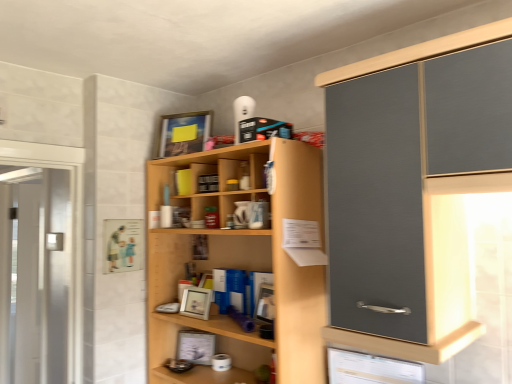
Question: Which direction should I rotate to look at white matte picture frame at center, which ranks as the 2th picture frame in top-to-bottom order?

Choices:
 (A) right
 (B) left

Answer: (B)

Question: From a real-world perspective, does metallic silver picture frame at lower center, which appears as the first picture frame when ordered from the bottom, stand above light wood cupboard at center?

Choices:
 (A) no
 (B) yes

Answer: (A)

Question: Does metallic silver picture frame at lower center, the third picture frame positioned from the top, have a greater width compared to light wood cupboard at center?

Choices:
 (A) yes
 (B) no

Answer: (B)

Question: From the image's perspective, does metallic silver picture frame at lower center, which appears as the first picture frame when ordered from the bottom, appear lower than light wood cupboard at center?

Choices:
 (A) no
 (B) yes

Answer: (B)

Question: Does metallic silver picture frame at lower center, which appears as the first picture frame when ordered from the bottom, turn towards light wood cupboard at center?

Choices:
 (A) yes
 (B) no

Answer: (A)

Question: Is metallic silver picture frame at lower center, the third picture frame positioned from the top, looking in the opposite direction of light wood cupboard at center?

Choices:
 (A) yes
 (B) no

Answer: (A)

Question: Is metallic silver picture frame at lower center, the third picture frame positioned from the top, at the right side of light wood cupboard at center?

Choices:
 (A) no
 (B) yes

Answer: (A)

Question: Is metallic silver picture frame at lower center, which appears as the first picture frame when ordered from the bottom, thinner than matte wooden picture frame at upper center, which is the first picture frame in top-to-bottom order?

Choices:
 (A) no
 (B) yes

Answer: (B)

Question: Would you say metallic silver picture frame at lower center, the third picture frame positioned from the top, contains matte wooden picture frame at upper center, placed as the third picture frame when sorted from bottom to top?

Choices:
 (A) no
 (B) yes

Answer: (A)

Question: Does metallic silver picture frame at lower center, the third picture frame positioned from the top, appear on the left side of matte wooden picture frame at upper center, which is the first picture frame in top-to-bottom order?

Choices:
 (A) yes
 (B) no

Answer: (B)

Question: Can you confirm if metallic silver picture frame at lower center, which appears as the first picture frame when ordered from the bottom, is wider than matte wooden picture frame at upper center, placed as the third picture frame when sorted from bottom to top?

Choices:
 (A) yes
 (B) no

Answer: (B)

Question: Is metallic silver picture frame at lower center, which appears as the first picture frame when ordered from the bottom, to the right of matte wooden picture frame at upper center, which is the first picture frame in top-to-bottom order, from the viewer's perspective?

Choices:
 (A) no
 (B) yes

Answer: (B)

Question: From the image's perspective, is metallic silver picture frame at lower center, the third picture frame positioned from the top, located beneath matte wooden picture frame at upper center, placed as the third picture frame when sorted from bottom to top?

Choices:
 (A) yes
 (B) no

Answer: (A)

Question: Does matte wooden picture frame at upper center, which is the first picture frame in top-to-bottom order, contain white matte picture frame at center, which ranks as the 2th picture frame in top-to-bottom order?

Choices:
 (A) no
 (B) yes

Answer: (A)